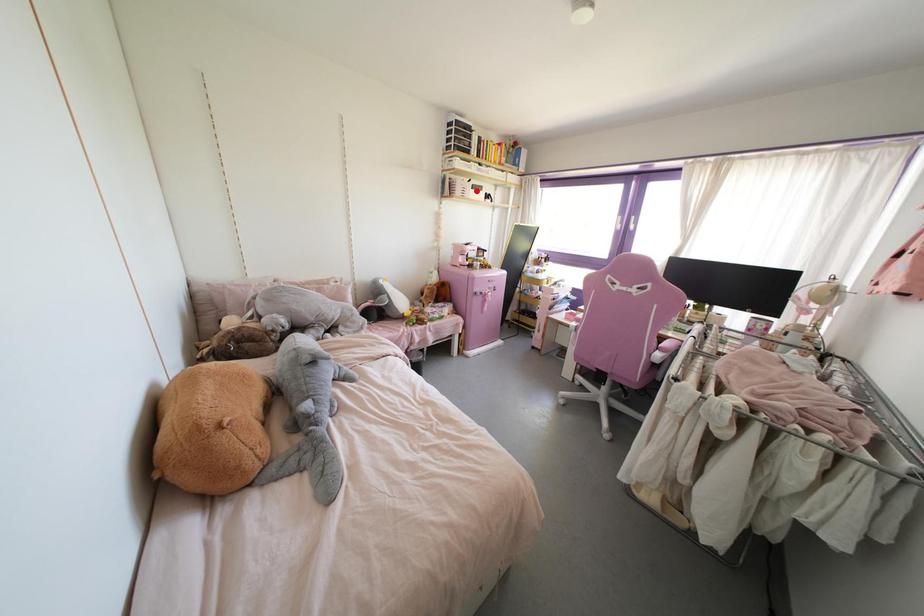
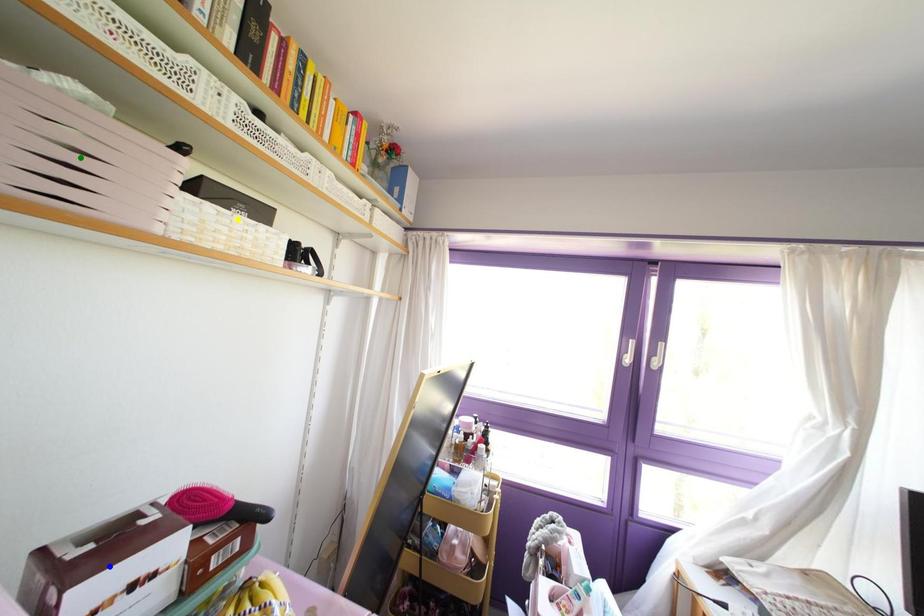
Question: I am providing you with two images of the same scene from different viewpoints. A red point is marked on the first image. You are given multiple points on the second image. Which point in image 2 represents the same 3d spot as the red point in image 1?

Choices:
 (A) green point
 (B) blue point
 (C) yellow point

Answer: (C)